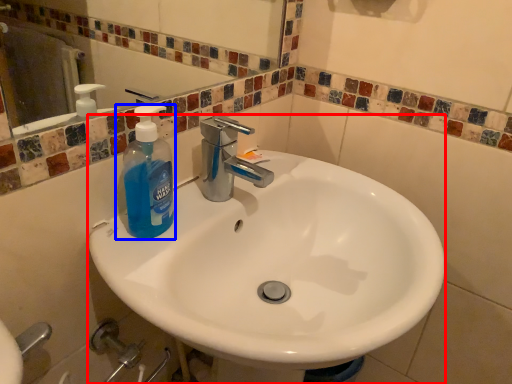
Question: Which point is closer to the camera, sink (highlighted by a red box) or bottle (highlighted by a blue box)?

Choices:
 (A) sink
 (B) bottle

Answer: (A)